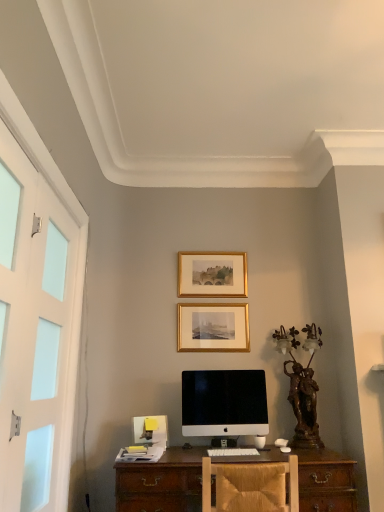
What do you see at coordinates (33, 332) in the screenshot?
I see `white matte screen door at left` at bounding box center [33, 332].

Where is `bronze statue at right`? bronze statue at right is located at coordinates (302, 385).

Identify the location of gold metallic picture frame at center, which is the second picture frame from top to bottom. (213, 328).

You are a GUI agent. You are given a task and a screenshot of the screen. Output one action in this format:
    pyautogui.click(x=<x>, y=<y>)
    Task: Click on the sleek white monitor at center
    
    Given the screenshot: What is the action you would take?
    pyautogui.click(x=224, y=403)

What do you see at coordinates (212, 274) in the screenshot? I see `gold/gilded picture frame at upper center, positioned as the second picture frame in bottom-to-top order` at bounding box center [212, 274].

What is the approximate height of wooden chair at center?

14.32 inches.

What are the coordinates of `white matte screen door at left` in the screenshot? It's located at (x=33, y=332).

Can you confirm if bronze statue at right is wider than sleek white monitor at center?

Yes.

Based on the photo, would you say sleek white monitor at center is part of bronze statue at right's contents?

No, sleek white monitor at center is not inside bronze statue at right.

Consider the image. From their relative heights in the image, would you say bronze statue at right is taller or shorter than sleek white monitor at center?

bronze statue at right is taller than sleek white monitor at center.

Consider the image. Is bronze statue at right turned away from sleek white monitor at center?

No.

Considering the positions of point (187, 310) and point (246, 283), is point (187, 310) closer or farther from the camera than point (246, 283)?

Point (187, 310) is positioned closer to the camera compared to point (246, 283).

Is gold metallic picture frame at center, positioned as the 1th picture frame in bottom-to-top order, facing away from gold/gilded picture frame at upper center, positioned as the second picture frame in bottom-to-top order?

That's not correct — gold metallic picture frame at center, positioned as the 1th picture frame in bottom-to-top order, is not looking away from gold/gilded picture frame at upper center, positioned as the second picture frame in bottom-to-top order.

Choose the correct answer: Is gold metallic picture frame at center, which is the second picture frame from top to bottom, inside gold/gilded picture frame at upper center, positioned as the second picture frame in bottom-to-top order, or outside it?

gold metallic picture frame at center, which is the second picture frame from top to bottom, lies outside gold/gilded picture frame at upper center, positioned as the second picture frame in bottom-to-top order.

Between wooden chair at center and gold/gilded picture frame at upper center, positioned as the second picture frame in bottom-to-top order, which one appears on the left side from the viewer's perspective?

Positioned to the left is gold/gilded picture frame at upper center, positioned as the second picture frame in bottom-to-top order.

I want to click on the 2nd picture frame above when counting from the wooden chair at center (from the image's perspective), so click(212, 274).

Is wooden chair at center not inside gold/gilded picture frame at upper center, positioned as the second picture frame in bottom-to-top order?

Yes, wooden chair at center is not within gold/gilded picture frame at upper center, positioned as the second picture frame in bottom-to-top order.

Is wooden chair at center not close to gold/gilded picture frame at upper center, positioned as the second picture frame in bottom-to-top order?

That's right, there is a large distance between wooden chair at center and gold/gilded picture frame at upper center, positioned as the second picture frame in bottom-to-top order.

Looking at this image, from the image's perspective, relative to bronze statue at right, is gold metallic picture frame at center, positioned as the 1th picture frame in bottom-to-top order, above or below?

From the image's perspective, gold metallic picture frame at center, positioned as the 1th picture frame in bottom-to-top order, appears above bronze statue at right.

Which object is closer to the camera taking this photo, gold metallic picture frame at center, positioned as the 1th picture frame in bottom-to-top order, or bronze statue at right?

bronze statue at right.

Can you confirm if gold metallic picture frame at center, positioned as the 1th picture frame in bottom-to-top order, is shorter than bronze statue at right?

Yes, gold metallic picture frame at center, positioned as the 1th picture frame in bottom-to-top order, is shorter than bronze statue at right.

Considering the relative sizes of gold metallic picture frame at center, positioned as the 1th picture frame in bottom-to-top order, and bronze statue at right in the image provided, is gold metallic picture frame at center, positioned as the 1th picture frame in bottom-to-top order, bigger than bronze statue at right?

No.

Is the surface of gold/gilded picture frame at upper center, the 1th picture frame positioned from the top, in direct contact with gold metallic picture frame at center, positioned as the 1th picture frame in bottom-to-top order?

There is a gap between gold/gilded picture frame at upper center, the 1th picture frame positioned from the top, and gold metallic picture frame at center, positioned as the 1th picture frame in bottom-to-top order.

Can you confirm if gold/gilded picture frame at upper center, positioned as the second picture frame in bottom-to-top order, is shorter than gold metallic picture frame at center, which is the second picture frame from top to bottom?

Indeed, gold/gilded picture frame at upper center, positioned as the second picture frame in bottom-to-top order, has a lesser height compared to gold metallic picture frame at center, which is the second picture frame from top to bottom.

What's the angular difference between gold/gilded picture frame at upper center, positioned as the second picture frame in bottom-to-top order, and gold metallic picture frame at center, positioned as the 1th picture frame in bottom-to-top order,'s facing directions?

There is a 0.396-degree angle between the facing directions of gold/gilded picture frame at upper center, positioned as the second picture frame in bottom-to-top order, and gold metallic picture frame at center, positioned as the 1th picture frame in bottom-to-top order.

Considering the positions of objects gold/gilded picture frame at upper center, the 1th picture frame positioned from the top, and gold metallic picture frame at center, positioned as the 1th picture frame in bottom-to-top order, in the image provided, who is more to the right, gold/gilded picture frame at upper center, the 1th picture frame positioned from the top, or gold metallic picture frame at center, positioned as the 1th picture frame in bottom-to-top order,?

Positioned to the right is gold/gilded picture frame at upper center, the 1th picture frame positioned from the top.

From the image's perspective, relative to white matte screen door at left, is gold/gilded picture frame at upper center, positioned as the second picture frame in bottom-to-top order, above or below?

From the image's perspective, gold/gilded picture frame at upper center, positioned as the second picture frame in bottom-to-top order, appears above white matte screen door at left.

From a real-world perspective, relative to white matte screen door at left, is gold/gilded picture frame at upper center, the 1th picture frame positioned from the top, vertically above or below?

In terms of real-world spatial position, gold/gilded picture frame at upper center, the 1th picture frame positioned from the top, is above white matte screen door at left.

Which object is further away from the camera, gold/gilded picture frame at upper center, positioned as the second picture frame in bottom-to-top order, or white matte screen door at left?

gold/gilded picture frame at upper center, positioned as the second picture frame in bottom-to-top order, is further away from the camera.

Is bronze statue at right oriented away from wooden chair at center?

No, bronze statue at right is not facing away from wooden chair at center.

Is bronze statue at right smaller than wooden chair at center?

Yes, bronze statue at right is smaller than wooden chair at center.

Is bronze statue at right not near wooden chair at center?

That's not correct — bronze statue at right is a little close to wooden chair at center.

Which object is positioned more to the left, bronze statue at right or wooden chair at center?

wooden chair at center.

At what (x,y) coordinates should I click in order to perform the action: click on antique in front of the sleek white monitor at center. Please return your answer as a coordinate pair (x, y). Looking at the image, I should click on (302, 385).

Identify the location of picture frame on the right of gold metallic picture frame at center, positioned as the 1th picture frame in bottom-to-top order. (212, 274).

Considering their positions, is wooden chair at center positioned further to gold/gilded picture frame at upper center, positioned as the second picture frame in bottom-to-top order, than sleek white monitor at center?

Among the two, wooden chair at center is located further to gold/gilded picture frame at upper center, positioned as the second picture frame in bottom-to-top order.

Looking at this image, which object lies further to the anchor point gold/gilded picture frame at upper center, the 1th picture frame positioned from the top, wooden chair at center or bronze statue at right?

wooden chair at center is positioned further to the anchor gold/gilded picture frame at upper center, the 1th picture frame positioned from the top.

From the image, which object appears to be farther from gold/gilded picture frame at upper center, positioned as the second picture frame in bottom-to-top order, bronze statue at right or wooden chair at center?

wooden chair at center lies further to gold/gilded picture frame at upper center, positioned as the second picture frame in bottom-to-top order, than the other object.

Looking at the image, which one is located closer to bronze statue at right, wooden chair at center or white matte screen door at left?

Based on the image, wooden chair at center appears to be nearer to bronze statue at right.

Consider the image. Which object lies further to the anchor point bronze statue at right, gold metallic picture frame at center, positioned as the 1th picture frame in bottom-to-top order, or sleek white monitor at center?

Based on the image, gold metallic picture frame at center, positioned as the 1th picture frame in bottom-to-top order, appears to be further to bronze statue at right.

Looking at the image, which one is located closer to bronze statue at right, wooden chair at center or gold/gilded picture frame at upper center, positioned as the second picture frame in bottom-to-top order?

gold/gilded picture frame at upper center, positioned as the second picture frame in bottom-to-top order.

Considering their positions, is sleek white monitor at center positioned closer to gold/gilded picture frame at upper center, positioned as the second picture frame in bottom-to-top order, than wooden chair at center?

sleek white monitor at center is closer to gold/gilded picture frame at upper center, positioned as the second picture frame in bottom-to-top order.

Estimate the real-world distances between objects in this image. Which object is closer to sleek white monitor at center, white matte screen door at left or gold/gilded picture frame at upper center, positioned as the second picture frame in bottom-to-top order?

gold/gilded picture frame at upper center, positioned as the second picture frame in bottom-to-top order.

At what (x,y) coordinates should I click in order to perform the action: click on antique positioned between white matte screen door at left and gold/gilded picture frame at upper center, the 1th picture frame positioned from the top, from near to far. Please return your answer as a coordinate pair (x, y). Image resolution: width=384 pixels, height=512 pixels. Looking at the image, I should click on (302, 385).

You are a GUI agent. You are given a task and a screenshot of the screen. Output one action in this format:
    pyautogui.click(x=<x>, y=<y>)
    Task: Click on the computer monitor between wooden chair at center and gold metallic picture frame at center, which is the second picture frame from top to bottom, along the z-axis
    
    Given the screenshot: What is the action you would take?
    point(224,403)

Find the location of `computer monitor located between white matte screen door at left and gold metallic picture frame at center, positioned as the 1th picture frame in bottom-to-top order, in the depth direction`. computer monitor located between white matte screen door at left and gold metallic picture frame at center, positioned as the 1th picture frame in bottom-to-top order, in the depth direction is located at coordinates (224, 403).

What are the coordinates of `computer monitor located between wooden chair at center and gold/gilded picture frame at upper center, the 1th picture frame positioned from the top, in the depth direction` in the screenshot? It's located at (224, 403).